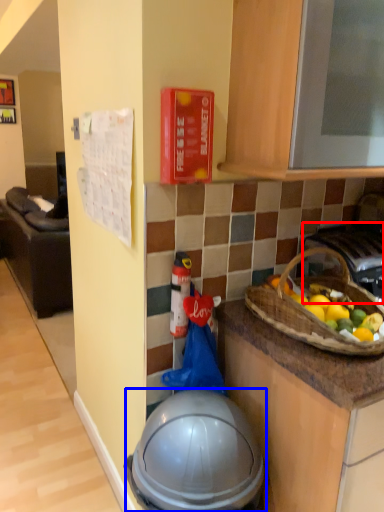
Question: Which point is further to the camera, gas stove (highlighted by a red box) or helmet (highlighted by a blue box)?

Choices:
 (A) gas stove
 (B) helmet

Answer: (A)